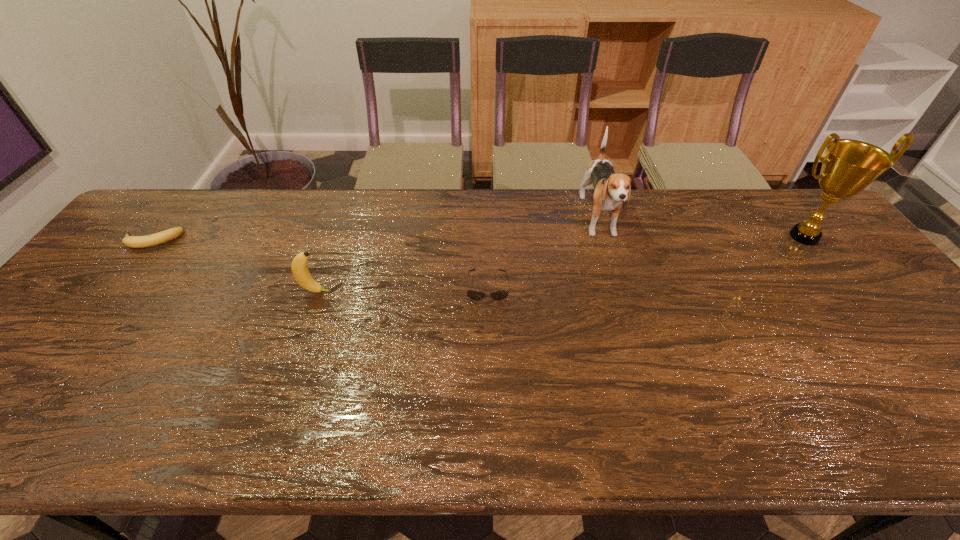
At what (x,y) coordinates should I click in order to perform the action: click on vacant point located between the fourth object from right to left and the tallest object. Please return your answer as a coordinate pair (x, y). The height and width of the screenshot is (540, 960). Looking at the image, I should click on (561, 264).

Identify the location of empty space between the award and the third object from left to right. (646, 261).

Identify the location of free point between the leftmost object and the third object from left to right. Image resolution: width=960 pixels, height=540 pixels. (319, 263).

Identify the location of vacant region between the taller banana and the third object from right to left. (402, 289).

At what (x,y) coordinates should I click in order to perform the action: click on free space between the shorter banana and the second tallest object. Please return your answer as a coordinate pair (x, y). This screenshot has height=540, width=960. Looking at the image, I should click on (374, 231).

Locate an element on the screen. object that can be found as the second closest to the sunglasses is located at coordinates (299, 267).

This screenshot has width=960, height=540. Identify the location of object that stands as the second closest to the puppy. (848, 166).

Where is `free spot that satisfies the following two spatial constraints: 1. on the front view with handles of the award; 2. from the stem of the right banana`? The height and width of the screenshot is (540, 960). free spot that satisfies the following two spatial constraints: 1. on the front view with handles of the award; 2. from the stem of the right banana is located at coordinates coord(848,292).

You are a GUI agent. You are given a task and a screenshot of the screen. Output one action in this format:
    pyautogui.click(x=<x>, y=<y>)
    Task: Click on the vacant space that satisfies the following two spatial constraints: 1. at the face of the second tallest object; 2. from the stem of the second object from left to right
    
    Given the screenshot: What is the action you would take?
    pyautogui.click(x=620, y=292)

Locate an element on the screen. This screenshot has height=540, width=960. vacant space that satisfies the following two spatial constraints: 1. at the face of the puppy; 2. from the stem of the third tallest object is located at coordinates (620, 292).